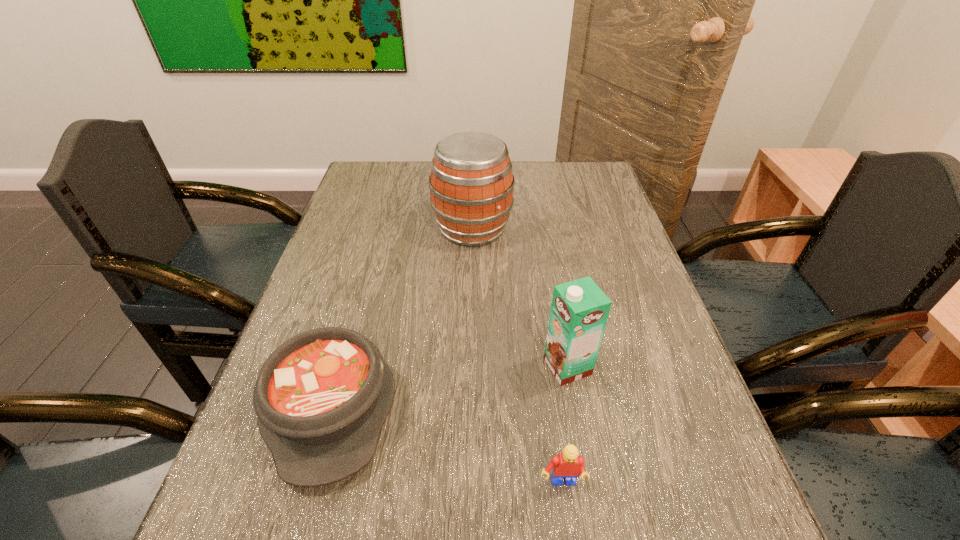
The image size is (960, 540). I want to click on blank area at the left edge, so click(359, 257).

In the image, there is a desktop. What are the coordinates of `vacant space at the right edge` in the screenshot? It's located at (718, 498).

The image size is (960, 540). Identify the location of vacant space at the far left corner of the desktop. (392, 193).

Where is `free space at the far right corner of the desktop`? free space at the far right corner of the desktop is located at coordinates (568, 167).

Where is `vacant area that lies between the farthest object and the leftmost object`? The image size is (960, 540). vacant area that lies between the farthest object and the leftmost object is located at coordinates (401, 316).

Find the location of a particular element. The height and width of the screenshot is (540, 960). empty space that is in between the Lego and the cider is located at coordinates pos(516,356).

Locate an element on the screen. The image size is (960, 540). free space between the carton and the leftmost object is located at coordinates (449, 386).

The image size is (960, 540). Identify the location of unoccupied area between the Lego and the cider. (516, 356).

Locate an element on the screen. free space between the cider and the carton is located at coordinates (520, 298).

I want to click on free spot between the third object from right to left and the leftmost object, so click(401, 316).